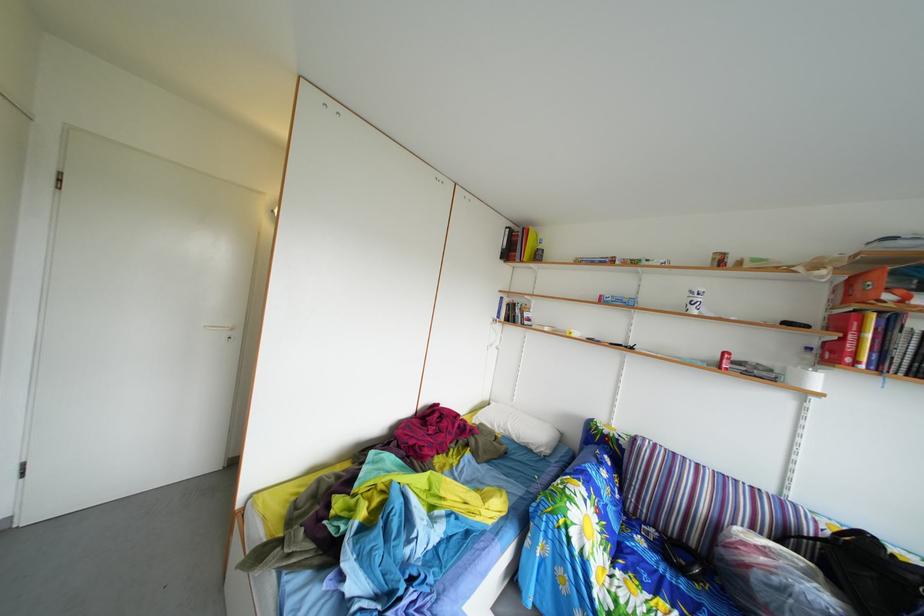
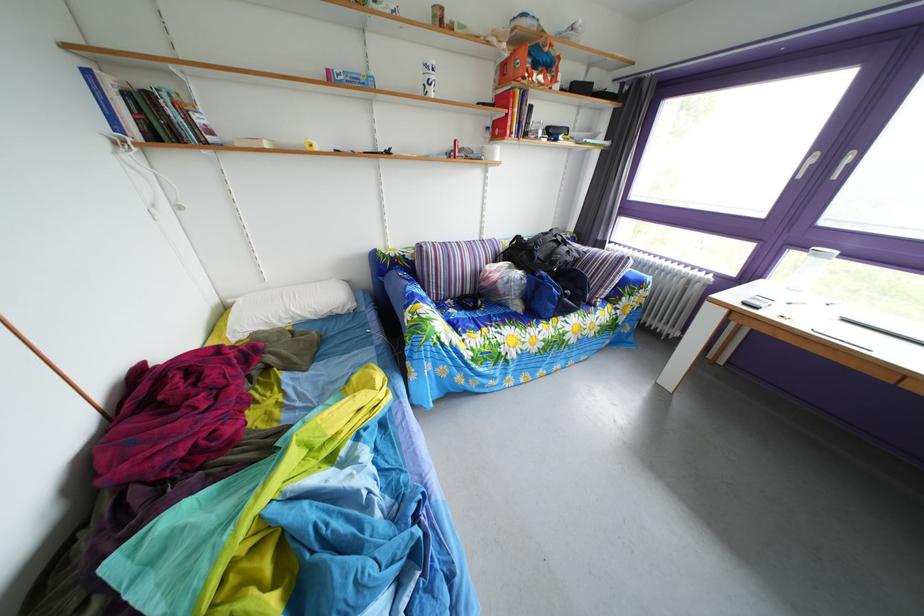
Locate, in the second image, the point that corresponds to the point at 869,573 in the first image.

(529, 261)